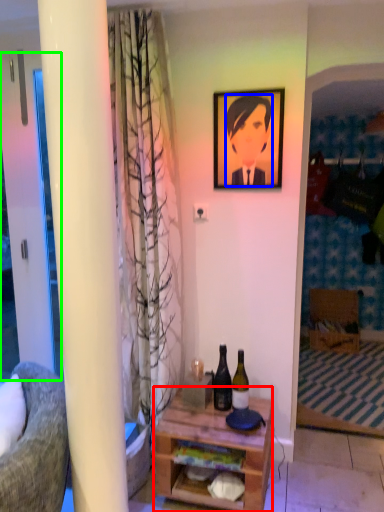
Question: Estimate the real-world distances between objects in this image. Which object is closer to desk (highlighted by a red box), person (highlighted by a blue box) or screen door (highlighted by a green box)?

Choices:
 (A) person
 (B) screen door

Answer: (B)